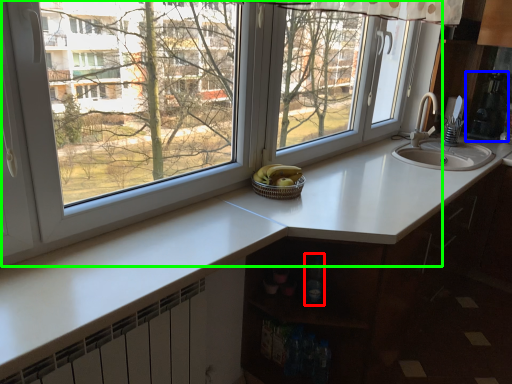
Question: Which object is positioned closest to bottle (highlighted by a red box)? Select from appliance (highlighted by a blue box) and window (highlighted by a green box).

Choices:
 (A) appliance
 (B) window

Answer: (B)